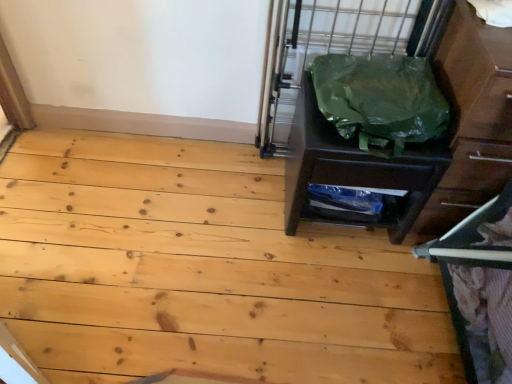
Question: Considering the relative positions of natural wood floor at center and green plastic bag at right in the image provided, is natural wood floor at center to the left of green plastic bag at right from the viewer's perspective?

Choices:
 (A) yes
 (B) no

Answer: (A)

Question: Is green plastic bag at right inside natural wood floor at center?

Choices:
 (A) no
 (B) yes

Answer: (A)

Question: From a real-world perspective, is natural wood floor at center on green plastic bag at right?

Choices:
 (A) yes
 (B) no

Answer: (B)

Question: Is there a large distance between natural wood floor at center and green plastic bag at right?

Choices:
 (A) no
 (B) yes

Answer: (A)

Question: Would you say natural wood floor at center is outside green plastic bag at right?

Choices:
 (A) yes
 (B) no

Answer: (A)

Question: Does natural wood floor at center have a greater height compared to green plastic bag at right?

Choices:
 (A) no
 (B) yes

Answer: (A)

Question: Is metallic gray bunk bed at right taller than natural wood floor at center?

Choices:
 (A) yes
 (B) no

Answer: (A)

Question: Is metallic gray bunk bed at right wider than natural wood floor at center?

Choices:
 (A) no
 (B) yes

Answer: (A)

Question: From the image's perspective, does metallic gray bunk bed at right appear higher than natural wood floor at center?

Choices:
 (A) no
 (B) yes

Answer: (A)

Question: Are metallic gray bunk bed at right and natural wood floor at center making contact?

Choices:
 (A) no
 (B) yes

Answer: (A)

Question: Is metallic gray bunk bed at right to the right of natural wood floor at center from the viewer's perspective?

Choices:
 (A) yes
 (B) no

Answer: (A)

Question: From the image's perspective, would you say metallic gray bunk bed at right is shown under natural wood floor at center?

Choices:
 (A) no
 (B) yes

Answer: (B)

Question: Is green plastic bag at right shorter than metallic gray bunk bed at right?

Choices:
 (A) yes
 (B) no

Answer: (A)